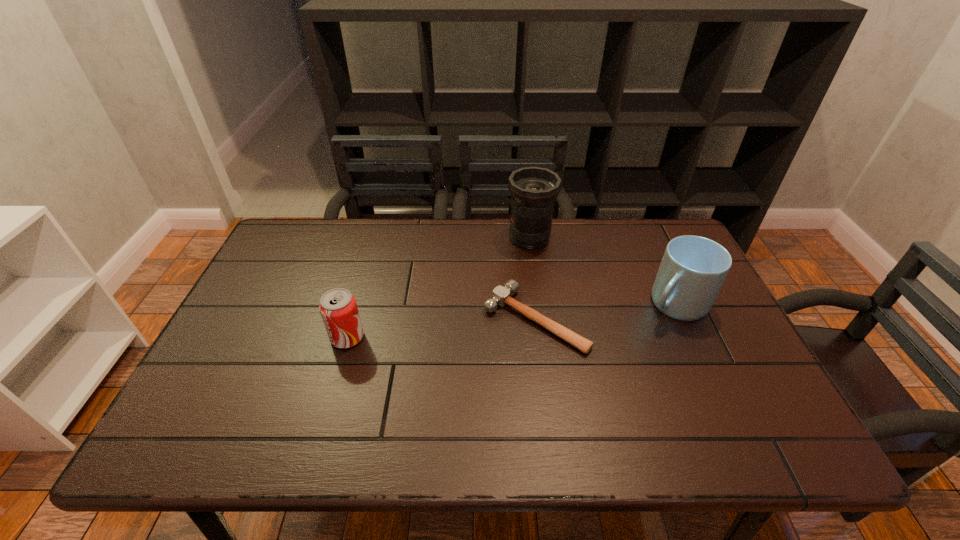
Find the location of `vacant point located between the shortest object and the tallest object`. vacant point located between the shortest object and the tallest object is located at coordinates (532, 279).

Find the location of a particular element. vacant space that is in between the rightmost object and the telephoto lens is located at coordinates (603, 271).

Find the location of a particular element. This screenshot has width=960, height=540. vacant space that's between the third tallest object and the tallest object is located at coordinates (439, 288).

You are a GUI agent. You are given a task and a screenshot of the screen. Output one action in this format:
    pyautogui.click(x=<x>, y=<y>)
    Task: Click on the free space between the rightmost object and the shortest object
    The width and height of the screenshot is (960, 540).
    Given the screenshot: What is the action you would take?
    pyautogui.click(x=605, y=312)

Identify the location of free space between the hammer and the telephoto lens. The width and height of the screenshot is (960, 540). (532, 279).

Identify the location of vacant space that's between the rightmost object and the farthest object. (603, 271).

The width and height of the screenshot is (960, 540). Find the location of `empty space between the shortest object and the rightmost object`. empty space between the shortest object and the rightmost object is located at coordinates (605, 312).

The width and height of the screenshot is (960, 540). What are the coordinates of `vacant space that's between the rightmost object and the hammer` in the screenshot? It's located at (605, 312).

The image size is (960, 540). In order to click on free space that is in between the hammer and the farthest object in this screenshot , I will do `click(532, 279)`.

Locate which object is the closest to the tallest object. Please provide its 2D coordinates. Your answer should be formatted as a tuple, i.e. [(x, y)], where the tuple contains the x and y coordinates of a point satisfying the conditions above.

[(501, 295)]